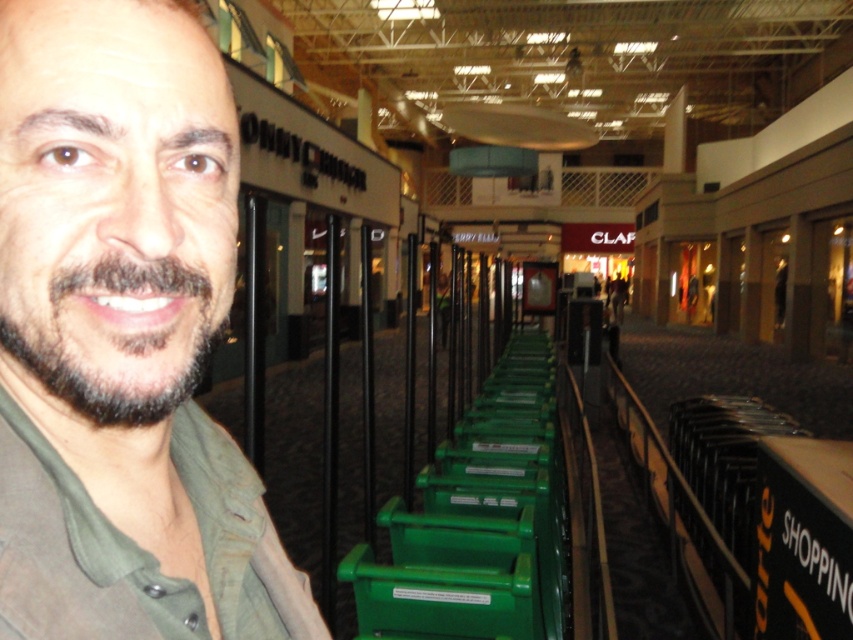
You are a photographer taking a picture of the matte green shirt at center and the dark brown fuzzy beard at left. Which object should you focus on first if you want to capture both in sharp focus?

The matte green shirt at center is to the left of the dark brown fuzzy beard at left, so you should focus on the matte green shirt at center first to ensure both are in sharp focus.

You are standing at the point labeled point (206, 273) in the shopping mall. You want to walk to the exit located at point (216, 436). Which direction should you move?

You should move forward towards the point (216, 436) because it is behind your current position at point (206, 273).

You are a photographer who wants to capture a closeup of the matte green shirt at center and the dark brown fuzzy beard at left. However, your camera has a limited field of view. Can you fit both objects in the frame without moving the camera?

The matte green shirt at center might be wider than dark brown fuzzy beard at left, so there is a possibility that both can fit in the frame. However, since the exact width difference is uncertain, it would depend on the camera lens and framing adjustments.